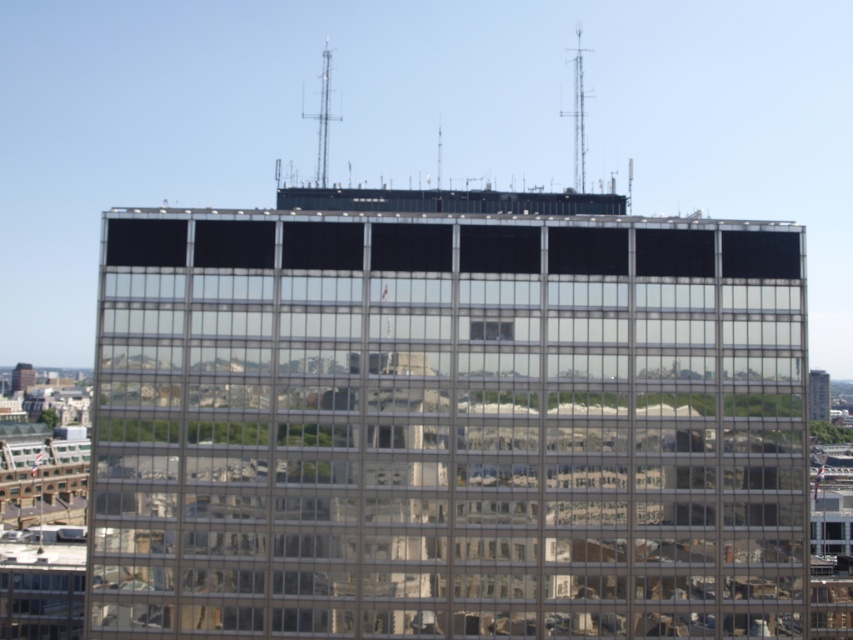
Is metallic antenna at top right positioned at the back of glassy reflective tower at right?

Yes, it is behind glassy reflective tower at right.

This screenshot has width=853, height=640. I want to click on metallic antenna at top right, so click(x=577, y=115).

Does metallic antenna at top right have a larger size compared to matte glass tower at lower left?

Correct, metallic antenna at top right is larger in size than matte glass tower at lower left.

Which is behind, point (577, 150) or point (20, 384)?

The point (577, 150) is behind.

Identify the location of metallic antenna at top right. (577, 115).

Based on the photo, which is below, clear glass windows at center or metallic antenna at top right?

Positioned lower is clear glass windows at center.

Consider the image. Between clear glass windows at center and metallic antenna at top right, which one is positioned higher?

Positioned higher is metallic antenna at top right.

Is point (537, 579) positioned behind point (573, 58)?

No, it is in front of (573, 58).

The width and height of the screenshot is (853, 640). I want to click on clear glass windows at center, so click(x=447, y=426).